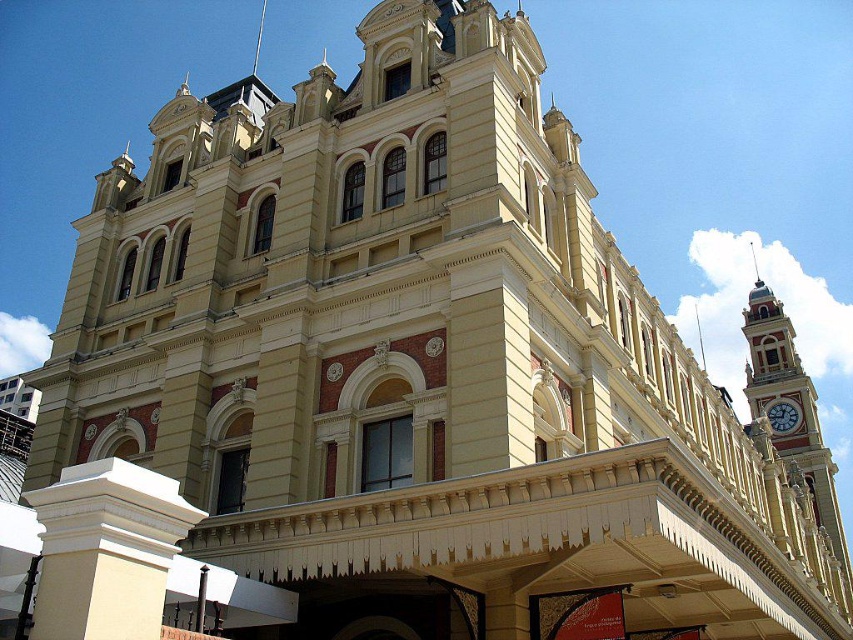
Between gold-painted metal clock tower at right and white glossy clock at upper right, which one has less height?

With less height is white glossy clock at upper right.

Is point (791, 326) more distant than point (770, 406)?

Yes, it is behind point (770, 406).

Where is `gold-painted metal clock tower at right`? This screenshot has height=640, width=853. gold-painted metal clock tower at right is located at coordinates (795, 401).

Which is above, white smooth pillar at lower left or white glossy clock at upper right?

white smooth pillar at lower left

Does white smooth pillar at lower left have a larger size compared to white glossy clock at upper right?

No.

What do you see at coordinates (106, 550) in the screenshot? I see `white smooth pillar at lower left` at bounding box center [106, 550].

Locate an element on the screen. Image resolution: width=853 pixels, height=640 pixels. white smooth pillar at lower left is located at coordinates (106, 550).

Who is positioned more to the left, white smooth pillar at lower left or gold-painted metal clock tower at right?

white smooth pillar at lower left

Does white smooth pillar at lower left appear on the right side of gold-painted metal clock tower at right?

Incorrect, white smooth pillar at lower left is not on the right side of gold-painted metal clock tower at right.

Does point (88, 612) lie in front of point (822, 508)?

Yes, point (88, 612) is closer to viewer.

This screenshot has height=640, width=853. Identify the location of white smooth pillar at lower left. (106, 550).